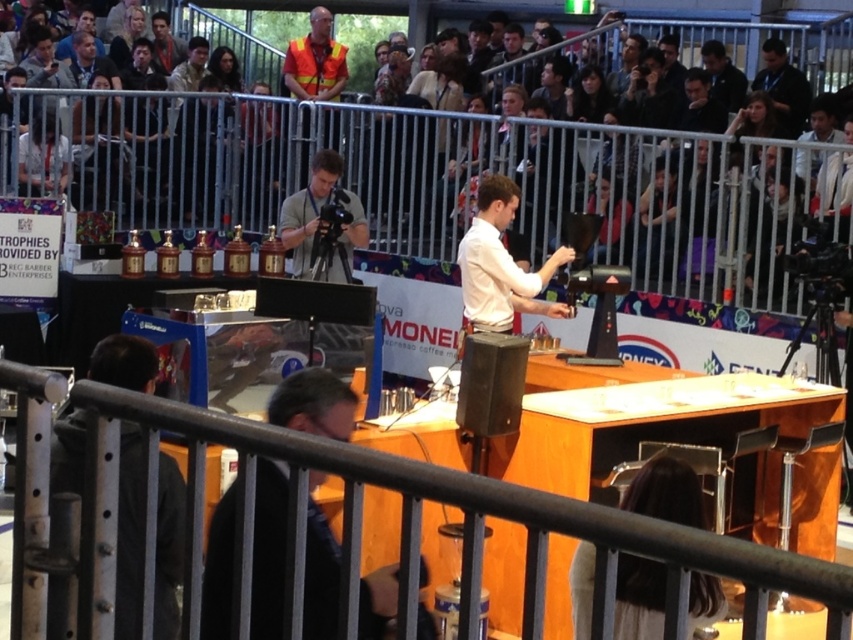
Question: Does dark gray fabric seats at upper center appear under dark blue shirt at upper right?

Choices:
 (A) yes
 (B) no

Answer: (A)

Question: Among these points, which one is nearest to the camera?

Choices:
 (A) (584, 120)
 (B) (718, 44)

Answer: (A)

Question: Where is gray fabric camera at center located in relation to black shirt at upper right in the image?

Choices:
 (A) right
 (B) left

Answer: (B)

Question: Among these objects, which one is farthest from the camera?

Choices:
 (A) black shirt at upper right
 (B) white glossy shirt at center

Answer: (A)

Question: Does metal at center appear on the right side of white glossy shirt at center?

Choices:
 (A) yes
 (B) no

Answer: (B)

Question: Which is nearer to the dark blue shirt at upper right?

Choices:
 (A) dark gray fabric seats at upper center
 (B) black shirt at upper right
 (C) black leather jacket at lower center

Answer: (B)